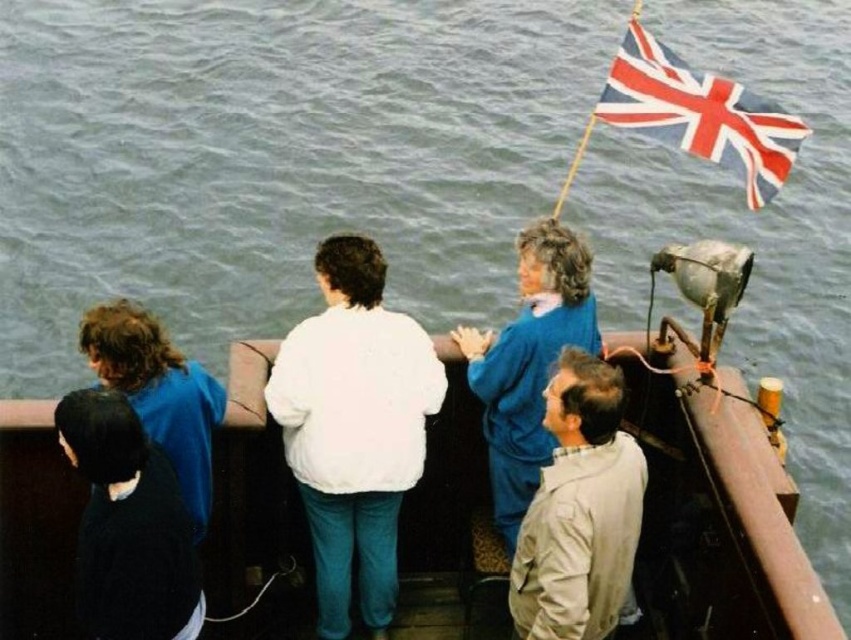
This screenshot has height=640, width=851. What do you see at coordinates (580, 509) in the screenshot?
I see `light beige fabric jacket at lower right` at bounding box center [580, 509].

Which of these two, light beige fabric jacket at lower right or union jack fabric flag at upper right, stands taller?

Standing taller between the two is union jack fabric flag at upper right.

Between point (557, 390) and point (749, 97), which one is positioned behind?

Point (749, 97)

You are a GUI agent. You are given a task and a screenshot of the screen. Output one action in this format:
    pyautogui.click(x=<x>, y=<y>)
    Task: Click on the light beige fabric jacket at lower right
    This screenshot has height=640, width=851.
    Given the screenshot: What is the action you would take?
    pyautogui.click(x=580, y=509)

Can you confirm if white fleece jacket at center is positioned above dark blue fabric jacket at lower left?

Incorrect, white fleece jacket at center is not positioned above dark blue fabric jacket at lower left.

Can you confirm if white fleece jacket at center is positioned below dark blue fabric jacket at lower left?

Yes, white fleece jacket at center is below dark blue fabric jacket at lower left.

Who is more distant from viewer, (398, 356) or (81, 330)?

The point (398, 356) is more distant.

Where is `white fleece jacket at center`? Image resolution: width=851 pixels, height=640 pixels. white fleece jacket at center is located at coordinates (353, 428).

Is black matte jacket at lower left shorter than dark blue fabric jacket at lower left?

No, black matte jacket at lower left is not shorter than dark blue fabric jacket at lower left.

Can you confirm if black matte jacket at lower left is thinner than dark blue fabric jacket at lower left?

No, black matte jacket at lower left is not thinner than dark blue fabric jacket at lower left.

The width and height of the screenshot is (851, 640). What do you see at coordinates (129, 525) in the screenshot?
I see `black matte jacket at lower left` at bounding box center [129, 525].

Where is `black matte jacket at lower left`? black matte jacket at lower left is located at coordinates (129, 525).